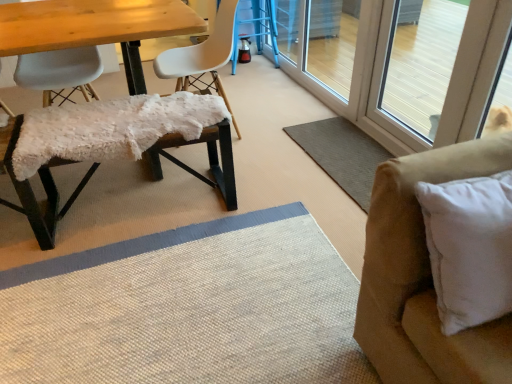
Where is `transparent glass screen door at right, which is the 2th screen door in back-to-front order`? The width and height of the screenshot is (512, 384). transparent glass screen door at right, which is the 2th screen door in back-to-front order is located at coordinates (362, 79).

The image size is (512, 384). In order to click on suede beige couch at right in this screenshot , I will do `click(423, 277)`.

Identify the location of transparent glass screen door at upper right, marked as the second screen door in a front-to-back arrangement. (320, 45).

The image size is (512, 384). Describe the element at coordinates (469, 248) in the screenshot. I see `white soft pillow at right` at that location.

Find the location of `white fluffy bench at left, marked as the second chair in a left-to-right arrangement`. white fluffy bench at left, marked as the second chair in a left-to-right arrangement is located at coordinates (32, 190).

Is white fluffy bench at left, arranged as the 2th chair when viewed from the right, shorter than transparent glass screen door at upper right, marked as the second screen door in a front-to-back arrangement?

Yes, white fluffy bench at left, arranged as the 2th chair when viewed from the right, is shorter than transparent glass screen door at upper right, marked as the second screen door in a front-to-back arrangement.

From a real-world perspective, which object rests below the other?

From a 3D spatial view, white fluffy bench at left, arranged as the 2th chair when viewed from the right, is below.

Is transparent glass screen door at upper right, which appears as the first screen door when viewed from the back, a part of white fluffy bench at left, marked as the second chair in a left-to-right arrangement?

Actually, transparent glass screen door at upper right, which appears as the first screen door when viewed from the back, is outside white fluffy bench at left, marked as the second chair in a left-to-right arrangement.

Are white fluffy bench at left, arranged as the 2th chair when viewed from the right, and transparent glass screen door at upper right, marked as the second screen door in a front-to-back arrangement, far apart?

Yes, white fluffy bench at left, arranged as the 2th chair when viewed from the right, and transparent glass screen door at upper right, marked as the second screen door in a front-to-back arrangement, are quite far apart.

Which point is more distant from viewer, (448,290) or (41,167)?

The point (41,167) is farther from the camera.

Is white soft pillow at right next to white fluffy bench at left, arranged as the 2th chair when viewed from the right?

No.

Which of these two, white soft pillow at right or white fluffy bench at left, arranged as the 2th chair when viewed from the right, is bigger?

With larger size is white fluffy bench at left, arranged as the 2th chair when viewed from the right.

Is white matte chair at center, the third chair when ordered from left to right, thinner than matte white plastic chair at left, marked as the 1th chair in a left-to-right arrangement?

No, white matte chair at center, the third chair when ordered from left to right, is not thinner than matte white plastic chair at left, marked as the 1th chair in a left-to-right arrangement.

How many degrees apart are the facing directions of white matte chair at center, the third chair when ordered from left to right, and matte white plastic chair at left, marked as the 1th chair in a left-to-right arrangement?

There is a 89.5-degree angle between the facing directions of white matte chair at center, the third chair when ordered from left to right, and matte white plastic chair at left, marked as the 1th chair in a left-to-right arrangement.

Would you say white matte chair at center, the third chair when ordered from left to right, is outside matte white plastic chair at left, marked as the 1th chair in a left-to-right arrangement?

Indeed, white matte chair at center, the third chair when ordered from left to right, is completely outside matte white plastic chair at left, marked as the 1th chair in a left-to-right arrangement.

Image resolution: width=512 pixels, height=384 pixels. Find the location of `chair that is above the white matte chair at center, which is the 1th chair in right-to-left order (from the image's perspective)`. chair that is above the white matte chair at center, which is the 1th chair in right-to-left order (from the image's perspective) is located at coordinates (60, 72).

From a real-world perspective, who is located higher, transparent glass screen door at right, which is the 2th screen door in back-to-front order, or transparent glass screen door at upper right, marked as the second screen door in a front-to-back arrangement?

transparent glass screen door at right, which is the 2th screen door in back-to-front order, is physically above.

Is transparent glass screen door at right, which is the 2th screen door in back-to-front order, shorter than transparent glass screen door at upper right, which appears as the first screen door when viewed from the back?

Incorrect, the height of transparent glass screen door at right, which is the 2th screen door in back-to-front order, does not fall short of that of transparent glass screen door at upper right, which appears as the first screen door when viewed from the back.

Is transparent glass screen door at right, which is the 2th screen door in back-to-front order, positioned beyond the bounds of transparent glass screen door at upper right, which appears as the first screen door when viewed from the back?

Yes, transparent glass screen door at right, which is the 2th screen door in back-to-front order, is located beyond the bounds of transparent glass screen door at upper right, which appears as the first screen door when viewed from the back.

Does transparent glass screen door at right, positioned as the first screen door in front-to-back order, have a larger size compared to transparent glass screen door at upper right, marked as the second screen door in a front-to-back arrangement?

No, transparent glass screen door at right, positioned as the first screen door in front-to-back order, is not bigger than transparent glass screen door at upper right, marked as the second screen door in a front-to-back arrangement.

Which of these two, white matte chair at center, which is the 1th chair in right-to-left order, or white soft pillow at right, is wider?

white matte chair at center, which is the 1th chair in right-to-left order.

From their relative heights in the image, would you say white matte chair at center, which is the 1th chair in right-to-left order, is taller or shorter than white soft pillow at right?

In the image, white matte chair at center, which is the 1th chair in right-to-left order, appears to be taller than white soft pillow at right.

Does white matte chair at center, the third chair when ordered from left to right, come behind white soft pillow at right?

Yes, white matte chair at center, the third chair when ordered from left to right, is further from the camera.

In the image, is transparent glass screen door at right, which is the 2th screen door in back-to-front order, positioned in front of or behind suede beige couch at right?

Clearly, transparent glass screen door at right, which is the 2th screen door in back-to-front order, is behind suede beige couch at right.

Does transparent glass screen door at right, positioned as the first screen door in front-to-back order, have a lesser height compared to suede beige couch at right?

In fact, transparent glass screen door at right, positioned as the first screen door in front-to-back order, may be taller than suede beige couch at right.

Considering the positions of objects transparent glass screen door at right, positioned as the first screen door in front-to-back order, and suede beige couch at right in the image provided, who is more to the left, transparent glass screen door at right, positioned as the first screen door in front-to-back order, or suede beige couch at right?

From the viewer's perspective, suede beige couch at right appears more on the left side.

Is transparent glass screen door at right, positioned as the first screen door in front-to-back order, facing towards suede beige couch at right?

No, transparent glass screen door at right, positioned as the first screen door in front-to-back order, is not aimed at suede beige couch at right.

Considering the relative sizes of transparent glass screen door at upper right, marked as the second screen door in a front-to-back arrangement, and white soft pillow at right in the image provided, is transparent glass screen door at upper right, marked as the second screen door in a front-to-back arrangement, thinner than white soft pillow at right?

Yes.

From a real-world perspective, which object rests below the other?

From a 3D spatial view, transparent glass screen door at upper right, which appears as the first screen door when viewed from the back, is below.

Is point (281, 39) more distant than point (486, 200)?

Yes, it is.

Is transparent glass screen door at upper right, which appears as the first screen door when viewed from the back, not within white soft pillow at right?

That's correct, transparent glass screen door at upper right, which appears as the first screen door when viewed from the back, is outside of white soft pillow at right.

Locate an element on the screen. the 3rd chair in front of the transparent glass screen door at upper right, marked as the second screen door in a front-to-back arrangement, starting your count from the anchor is located at coordinates (32, 190).

There is a white soft pillow at right. Where is `the 1st chair above it (from the image's perspective)`? This screenshot has width=512, height=384. the 1st chair above it (from the image's perspective) is located at coordinates (32, 190).

When comparing their distances from transparent glass screen door at upper right, marked as the second screen door in a front-to-back arrangement, does white soft pillow at right or matte white plastic chair at left, marked as the 1th chair in a left-to-right arrangement, seem closer?

The object closer to transparent glass screen door at upper right, marked as the second screen door in a front-to-back arrangement, is matte white plastic chair at left, marked as the 1th chair in a left-to-right arrangement.

From the image, which object appears to be farther from matte white plastic chair at left, the 3th chair viewed from the right, transparent glass screen door at right, which is the 2th screen door in back-to-front order, or beige textured mat at right?

Based on the image, transparent glass screen door at right, which is the 2th screen door in back-to-front order, appears to be further to matte white plastic chair at left, the 3th chair viewed from the right.

Which object lies further to the anchor point transparent glass screen door at upper right, which appears as the first screen door when viewed from the back, transparent glass screen door at right, positioned as the first screen door in front-to-back order, or white matte chair at center, the third chair when ordered from left to right?

white matte chair at center, the third chair when ordered from left to right, lies further to transparent glass screen door at upper right, which appears as the first screen door when viewed from the back, than the other object.

Which object lies nearer to the anchor point beige textured mat at right, transparent glass screen door at right, positioned as the first screen door in front-to-back order, or matte white plastic chair at left, marked as the 1th chair in a left-to-right arrangement?

The object closer to beige textured mat at right is transparent glass screen door at right, positioned as the first screen door in front-to-back order.

Considering their positions, is suede beige couch at right positioned further to white fluffy bench at left, arranged as the 2th chair when viewed from the right, than matte white plastic chair at left, marked as the 1th chair in a left-to-right arrangement?

Based on the image, suede beige couch at right appears to be further to white fluffy bench at left, arranged as the 2th chair when viewed from the right.

Consider the image. When comparing their distances from white matte chair at center, the third chair when ordered from left to right, does white soft pillow at right or transparent glass screen door at right, which is the 2th screen door in back-to-front order, seem further?

white soft pillow at right.

Looking at the image, which one is located further to suede beige couch at right, transparent glass screen door at upper right, which appears as the first screen door when viewed from the back, or white soft pillow at right?

transparent glass screen door at upper right, which appears as the first screen door when viewed from the back, is positioned further to the anchor suede beige couch at right.

Looking at the image, which one is located further to beige textured mat at right, white soft pillow at right or transparent glass screen door at upper right, which appears as the first screen door when viewed from the back?

white soft pillow at right lies further to beige textured mat at right than the other object.

Identify the location of chair situated between white fluffy bench at left, arranged as the 2th chair when viewed from the right, and beige textured mat at right from left to right. (202, 58).

You are a GUI agent. You are given a task and a screenshot of the screen. Output one action in this format:
    pyautogui.click(x=<x>, y=<y>)
    Task: Click on the mat located between white matte chair at center, which is the 1th chair in right-to-left order, and transparent glass screen door at right, which is the 2th screen door in back-to-front order, in the left-right direction
    Image resolution: width=512 pixels, height=384 pixels.
    Given the screenshot: What is the action you would take?
    pyautogui.click(x=342, y=154)

Find the location of a particular element. The width and height of the screenshot is (512, 384). mat situated between matte white plastic chair at left, the 3th chair viewed from the right, and white soft pillow at right from left to right is located at coordinates (342, 154).

Identify the location of studio couch positioned between white soft pillow at right and transparent glass screen door at right, positioned as the first screen door in front-to-back order, from near to far. This screenshot has height=384, width=512. (423, 277).